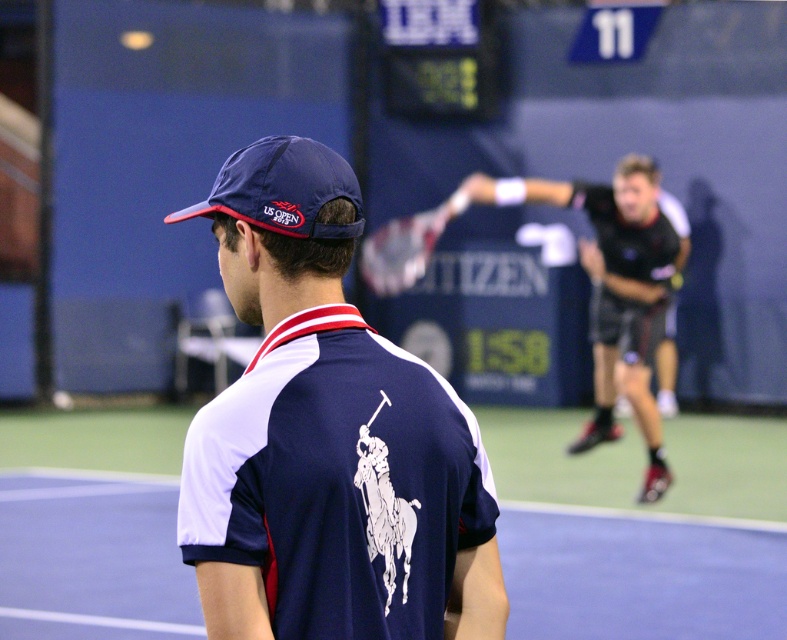
Question: Is black synthetic tennis racket at upper right closer to camera compared to white textured racket at center?

Choices:
 (A) no
 (B) yes

Answer: (B)

Question: Considering the real-world distances, which object is closest to the navy blue fabric polo shirt at center?

Choices:
 (A) black synthetic tennis racket at upper right
 (B) navy blue fabric cap at upper center
 (C) white textured racket at center

Answer: (B)

Question: Which object appears farthest from the camera in this image?

Choices:
 (A) black synthetic tennis racket at upper right
 (B) white textured racket at center

Answer: (B)

Question: Among these objects, which one is farthest from the camera?

Choices:
 (A) navy blue fabric cap at upper center
 (B) black synthetic tennis racket at upper right

Answer: (B)

Question: Observing the image, what is the correct spatial positioning of navy blue fabric polo shirt at center in reference to black synthetic tennis racket at upper right?

Choices:
 (A) above
 (B) below

Answer: (B)

Question: Is black synthetic tennis racket at upper right wider than white textured racket at center?

Choices:
 (A) yes
 (B) no

Answer: (A)